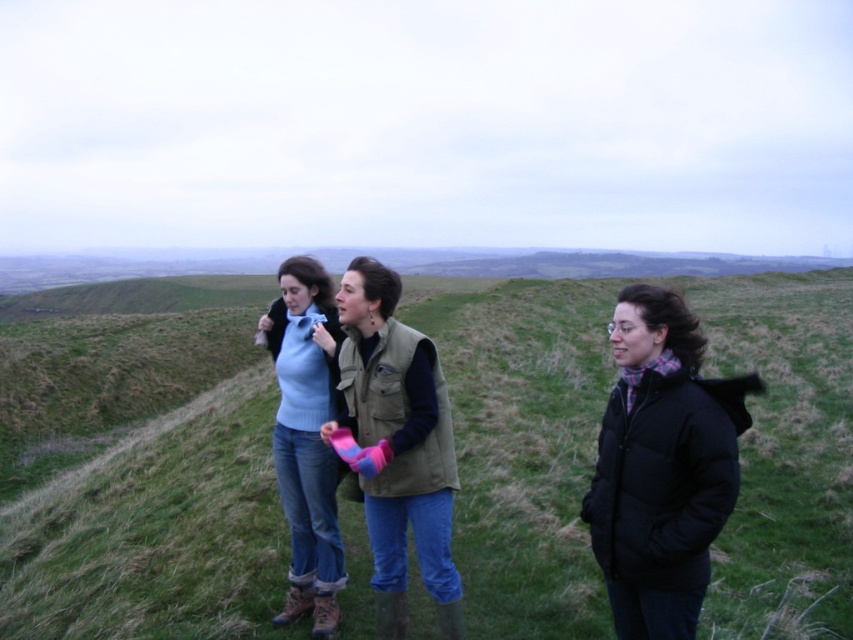
Can you confirm if green grassy hillside at center is thinner than khaki fabric vest at center?

No, green grassy hillside at center is not thinner than khaki fabric vest at center.

Does green grassy hillside at center have a larger size compared to khaki fabric vest at center?

Yes.

The height and width of the screenshot is (640, 853). What do you see at coordinates (138, 481) in the screenshot?
I see `green grassy hillside at center` at bounding box center [138, 481].

Where is `green grassy hillside at center`? The width and height of the screenshot is (853, 640). green grassy hillside at center is located at coordinates (138, 481).

Identify the location of green grassy hillside at center. This screenshot has width=853, height=640. (138, 481).

Is point (357, 598) positioned in front of point (315, 552)?

No, it is not.

Is point (573, 298) positioned before point (294, 268)?

No, (573, 298) is further to viewer.

The width and height of the screenshot is (853, 640). I want to click on green grassy hillside at center, so click(x=138, y=481).

Is khaki fabric vest at center further to camera compared to light blue sweater at center?

No, khaki fabric vest at center is closer to the viewer.

Is point (341, 280) positioned behind point (296, 552)?

No, (341, 280) is in front of (296, 552).

At what (x,y) coordinates should I click in order to perform the action: click on khaki fabric vest at center. Please return your answer as a coordinate pair (x, y). The width and height of the screenshot is (853, 640). Looking at the image, I should click on (398, 445).